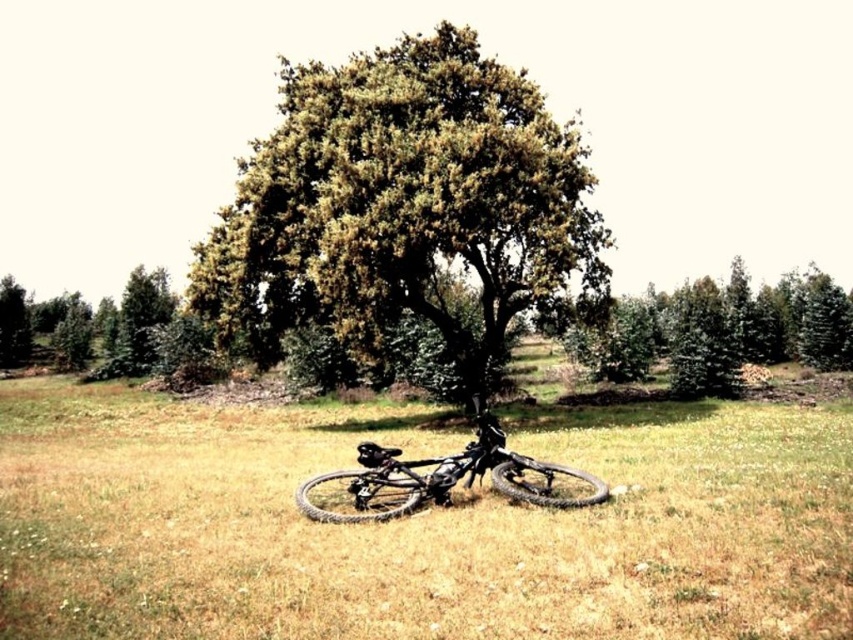
Who is higher up, black rubber bicycle at center or shiny metallic bicycle at center?

shiny metallic bicycle at center

Does point (282, 529) come behind point (520, 481)?

No.

At what (x,y) coordinates should I click in order to perform the action: click on black rubber bicycle at center. Please return your answer as a coordinate pair (x, y). This screenshot has height=640, width=853. Looking at the image, I should click on (416, 524).

Is green leafy tree at center below green leafy tree at left?

Incorrect, green leafy tree at center is not positioned below green leafy tree at left.

Does green leafy tree at center lie behind green leafy tree at left?

No, green leafy tree at center is in front of green leafy tree at left.

I want to click on green leafy tree at center, so click(x=403, y=208).

This screenshot has height=640, width=853. I want to click on green leafy tree at center, so click(403, 208).

Which is above, black rubber bicycle at center or green matte tree at right?

Positioned higher is green matte tree at right.

Is point (122, 584) farther from camera compared to point (827, 358)?

That is False.

This screenshot has height=640, width=853. In order to click on black rubber bicycle at center in this screenshot , I will do `click(416, 524)`.